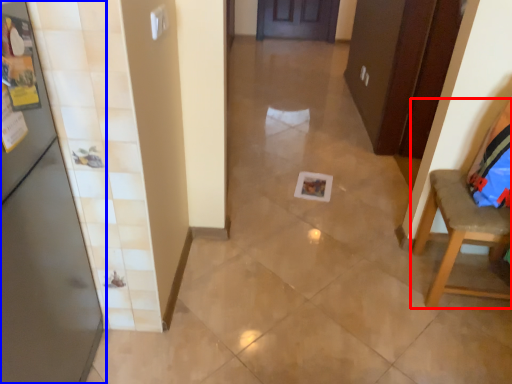
Question: Among these objects, which one is farthest to the camera, chair (highlighted by a red box) or door (highlighted by a blue box)?

Choices:
 (A) chair
 (B) door

Answer: (A)